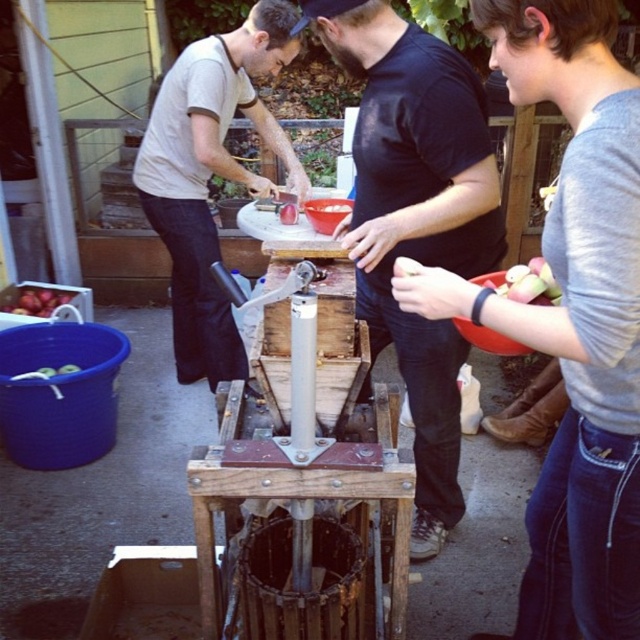
You are organizing a group photo and want to position the gray cotton shirt at upper right and the matte white shirt at upper left in a row. Which shirt should be placed on the left side of the row to ensure they fit within the frame without overlapping?

The gray cotton shirt at upper right has a lesser width compared to matte white shirt at upper left. To prevent overlapping, the narrower gray cotton shirt at upper right should be placed on the left side of the row, followed by the wider matte white shirt at upper left.

You are organizing a community apple pressing event and need to assign roles based on the participants clothing. You have two shirts available for identification tags. The gray cotton shirt at upper right and the matte white shirt at upper left. Which shirt should get the tag for the smaller size clothing?

The gray cotton shirt at upper right should get the tag for the smaller size clothing because it has a smaller size compared to the matte white shirt at upper left.